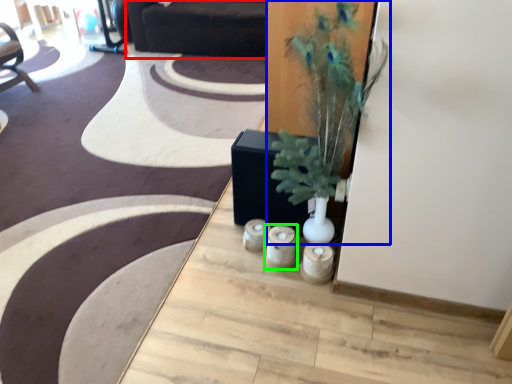
Question: Which is nearer to the couch (highlighted by a red box)? houseplant (highlighted by a blue box) or candle holder (highlighted by a green box).

Choices:
 (A) houseplant
 (B) candle holder

Answer: (A)